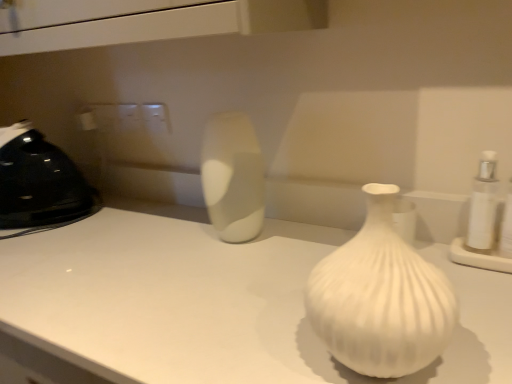
Where is `vacant space in between black plastic iron at left and satin white vase at center, which is the second vase from front to back`? vacant space in between black plastic iron at left and satin white vase at center, which is the second vase from front to back is located at coordinates (127, 232).